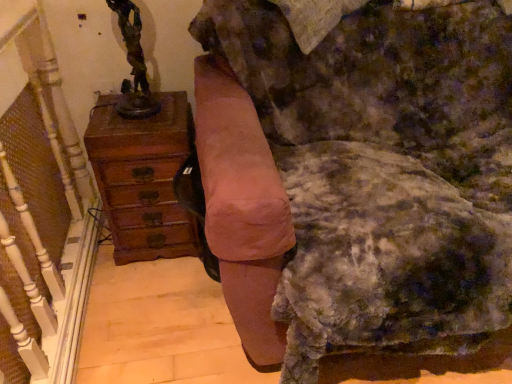
Question: From a real-world perspective, is velvet pink armchair at center physically above wooden chest of drawers at left?

Choices:
 (A) yes
 (B) no

Answer: (A)

Question: From the image's perspective, is velvet pink armchair at center on wooden chest of drawers at left?

Choices:
 (A) yes
 (B) no

Answer: (A)

Question: Does velvet pink armchair at center lie behind wooden chest of drawers at left?

Choices:
 (A) no
 (B) yes

Answer: (A)

Question: Is velvet pink armchair at center at the right side of wooden chest of drawers at left?

Choices:
 (A) yes
 (B) no

Answer: (A)

Question: Does velvet pink armchair at center come in front of wooden chest of drawers at left?

Choices:
 (A) no
 (B) yes

Answer: (B)

Question: Is point (161, 109) positioned closer to the camera than point (429, 297)?

Choices:
 (A) farther
 (B) closer

Answer: (A)

Question: In terms of size, does wooden chest of drawers at left appear bigger or smaller than suede-like pink swivel chair at center?

Choices:
 (A) big
 (B) small

Answer: (B)

Question: From the image's perspective, relative to suede-like pink swivel chair at center, is wooden chest of drawers at left above or below?

Choices:
 (A) above
 (B) below

Answer: (A)

Question: Looking at their shapes, would you say wooden chest of drawers at left is wider or thinner than suede-like pink swivel chair at center?

Choices:
 (A) wide
 (B) thin

Answer: (B)

Question: Visually, is wooden chest of drawers at left positioned to the left or to the right of bronze statue at upper left?

Choices:
 (A) right
 (B) left

Answer: (A)

Question: From the image's perspective, is wooden chest of drawers at left positioned above or below bronze statue at upper left?

Choices:
 (A) above
 (B) below

Answer: (B)

Question: Is wooden chest of drawers at left inside or outside of bronze statue at upper left?

Choices:
 (A) outside
 (B) inside

Answer: (A)

Question: Considering the positions of wooden chest of drawers at left and bronze statue at upper left in the image, is wooden chest of drawers at left wider or thinner than bronze statue at upper left?

Choices:
 (A) thin
 (B) wide

Answer: (B)

Question: Which is correct: wooden chest of drawers at left is inside velvet pink armchair at center, or outside of it?

Choices:
 (A) inside
 (B) outside

Answer: (B)

Question: From the image's perspective, is wooden chest of drawers at left above or below velvet pink armchair at center?

Choices:
 (A) above
 (B) below

Answer: (B)